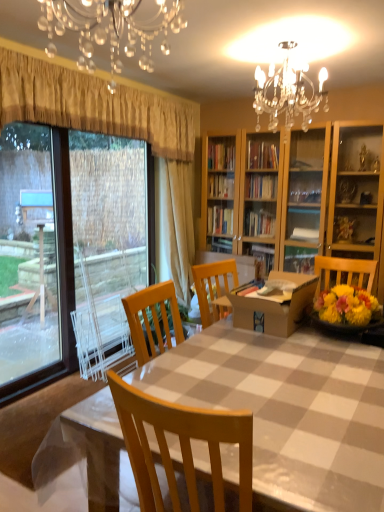
At what (x,y) coordinates should I click in order to perform the action: click on cardboard box at center. Please return your answer as a coordinate pair (x, y). Looking at the image, I should click on (274, 306).

The image size is (384, 512). Identify the location of crystal glass chandelier at upper center. (110, 29).

What do you see at coordinates (94, 105) in the screenshot? I see `gold textured curtain at upper left, positioned as the 1th curtain in front-to-back order` at bounding box center [94, 105].

The height and width of the screenshot is (512, 384). In order to click on gold textured curtain at upper left, positioned as the 1th curtain in front-to-back order in this screenshot , I will do `click(94, 105)`.

Measure the distance between point (x=337, y=507) and camera.

1.03 meters.

What do you see at coordinates (175, 225) in the screenshot?
I see `beige fabric curtain at center, which appears as the 2th curtain when viewed from the front` at bounding box center [175, 225].

Find the location of a particular element. cardboard box at center is located at coordinates (274, 306).

Would you say crystal glass chandelier at upper center is outside checkered plastic table at center?

crystal glass chandelier at upper center lies outside checkered plastic table at center's area.

From a real-world perspective, which is physically below, crystal glass chandelier at upper center or checkered plastic table at center?

checkered plastic table at center is physically lower.

Could you tell me if crystal glass chandelier at upper center is facing checkered plastic table at center?

No, crystal glass chandelier at upper center is not turned towards checkered plastic table at center.

Is crystal glass chandelier at upper center directly adjacent to checkered plastic table at center?

No, crystal glass chandelier at upper center is not beside checkered plastic table at center.

Which is more to the left, gold textured curtain at upper left, positioned as the 1th curtain in front-to-back order, or checkered plastic table at center?

Positioned to the left is gold textured curtain at upper left, positioned as the 1th curtain in front-to-back order.

Is gold textured curtain at upper left, positioned as the 1th curtain in front-to-back order, aimed at checkered plastic table at center?

No.

From a real-world perspective, does gold textured curtain at upper left, positioned as the 1th curtain in front-to-back order, sit lower than checkered plastic table at center?

No, from a real-world perspective, gold textured curtain at upper left, positioned as the 1th curtain in front-to-back order, is not under checkered plastic table at center.

Can you confirm if gold textured curtain at upper left, positioned as the 1th curtain in front-to-back order, is shorter than checkered plastic table at center?

Yes, gold textured curtain at upper left, positioned as the 1th curtain in front-to-back order, is shorter than checkered plastic table at center.

Is clear glass window at left not near crystal glass chandelier at upper center?

Yes, clear glass window at left is far from crystal glass chandelier at upper center.

Find the location of `bay window below the crystal glass chandelier at upper center (from a real-world perspective)`. bay window below the crystal glass chandelier at upper center (from a real-world perspective) is located at coordinates (59, 278).

Which of these two, clear glass window at left or crystal glass chandelier at upper center, is smaller?

crystal glass chandelier at upper center is smaller.

Does point (60, 210) appear closer or farther from the camera than point (51, 46)?

Point (60, 210) is farther from the camera than point (51, 46).

Based on the photo, which of these two, clear glass window at left or cardboard box at center, is smaller?

With smaller size is cardboard box at center.

Considering the points (63, 134) and (231, 298), which point is behind, point (63, 134) or point (231, 298)?

The point (63, 134) is farther from the camera.

Image resolution: width=384 pixels, height=512 pixels. In order to click on bay window above the cardboard box at center (from a real-world perspective) in this screenshot , I will do `click(59, 278)`.

Is clear glass window at left outside of cardboard box at center?

Indeed, clear glass window at left is completely outside cardboard box at center.

From the image's perspective, is beige fabric curtain at center, which appears as the 2th curtain when viewed from the front, on clear glass window at left?

Yes, from the image's perspective, beige fabric curtain at center, which appears as the 2th curtain when viewed from the front, is on top of clear glass window at left.

Is beige fabric curtain at center, which appears as the 2th curtain when viewed from the front, shorter than clear glass window at left?

Indeed, beige fabric curtain at center, which appears as the 2th curtain when viewed from the front, has a lesser height compared to clear glass window at left.

Choose the correct answer: Is beige fabric curtain at center, the 1th curtain when ordered from back to front, inside clear glass window at left or outside it?

beige fabric curtain at center, the 1th curtain when ordered from back to front, exists outside the volume of clear glass window at left.

Is beige fabric curtain at center, which appears as the 2th curtain when viewed from the front, oriented towards clear glass window at left?

No, beige fabric curtain at center, which appears as the 2th curtain when viewed from the front, is not aimed at clear glass window at left.

Is clear glass window at left next to checkered plastic table at center?

clear glass window at left and checkered plastic table at center are clearly separated.

Does point (68, 241) lie in front of point (374, 460)?

No, it is not.

Considering the sizes of clear glass window at left and checkered plastic table at center in the image, is clear glass window at left taller or shorter than checkered plastic table at center?

In the image, clear glass window at left appears to be taller than checkered plastic table at center.

Choose the correct answer: Is clear glass window at left inside checkered plastic table at center or outside it?

clear glass window at left is located beyond the bounds of checkered plastic table at center.

Are gold textured curtain at upper left, positioned as the 1th curtain in front-to-back order, and crystal glass chandelier at upper center far apart?

No, gold textured curtain at upper left, positioned as the 1th curtain in front-to-back order, is not far away from crystal glass chandelier at upper center.

Which is closer to the camera, [41,106] or [128,24]?

Point [128,24]

Is gold textured curtain at upper left, positioned as the 1th curtain in front-to-back order, bigger or smaller than crystal glass chandelier at upper center?

Clearly, gold textured curtain at upper left, positioned as the 1th curtain in front-to-back order, is larger in size than crystal glass chandelier at upper center.

Can you confirm if gold textured curtain at upper left, positioned as the 2th curtain in back-to-front order, is positioned to the left of crystal glass chandelier at upper center?

Correct, you'll find gold textured curtain at upper left, positioned as the 2th curtain in back-to-front order, to the left of crystal glass chandelier at upper center.

Find the location of a particular element. This screenshot has width=384, height=512. lamp lying in front of the checkered plastic table at center is located at coordinates coord(110,29).

The image size is (384, 512). I want to click on kitchen & dining room table on the right of the gold textured curtain at upper left, positioned as the 1th curtain in front-to-back order, so click(x=289, y=408).

Considering their positions, is checkered plastic table at center positioned closer to cardboard box at center than crystal glass chandelier at upper center?

checkered plastic table at center lies closer to cardboard box at center than the other object.

When comparing their distances from clear glass window at left, does gold textured curtain at upper left, positioned as the 2th curtain in back-to-front order, or crystal glass chandelier at upper center seem closer?

gold textured curtain at upper left, positioned as the 2th curtain in back-to-front order, is closer to clear glass window at left.

Based on the photo, based on their spatial positions, is clear glass window at left or crystal glass chandelier at upper center further from gold textured curtain at upper left, positioned as the 2th curtain in back-to-front order?

clear glass window at left is further to gold textured curtain at upper left, positioned as the 2th curtain in back-to-front order.

Based on their spatial positions, is gold textured curtain at upper left, positioned as the 1th curtain in front-to-back order, or beige fabric curtain at center, the 1th curtain when ordered from back to front, further from crystal glass chandelier at upper center?

The object further to crystal glass chandelier at upper center is beige fabric curtain at center, the 1th curtain when ordered from back to front.

In the scene shown: From the image, which object appears to be nearer to checkered plastic table at center, gold textured curtain at upper left, positioned as the 1th curtain in front-to-back order, or cardboard box at center?

cardboard box at center lies closer to checkered plastic table at center than the other object.

Which object lies further to the anchor point checkered plastic table at center, cardboard box at center or clear glass window at left?

clear glass window at left is positioned further to the anchor checkered plastic table at center.

When comparing their distances from cardboard box at center, does checkered plastic table at center or beige fabric curtain at center, which appears as the 2th curtain when viewed from the front, seem further?

beige fabric curtain at center, which appears as the 2th curtain when viewed from the front, lies further to cardboard box at center than the other object.

Which object lies further to the anchor point checkered plastic table at center, beige fabric curtain at center, the 1th curtain when ordered from back to front, or cardboard box at center?

beige fabric curtain at center, the 1th curtain when ordered from back to front, is further to checkered plastic table at center.

Identify the location of round table between checkered plastic table at center and beige fabric curtain at center, the 1th curtain when ordered from back to front, in the front-back direction. The height and width of the screenshot is (512, 384). (274, 306).

At what (x,y) coordinates should I click in order to perform the action: click on curtain located between crystal glass chandelier at upper center and beige fabric curtain at center, the 1th curtain when ordered from back to front, in the depth direction. Please return your answer as a coordinate pair (x, y). The image size is (384, 512). Looking at the image, I should click on (94, 105).

Find the location of a particular element. This screenshot has height=512, width=384. lamp between gold textured curtain at upper left, positioned as the 2th curtain in back-to-front order, and checkered plastic table at center, in the vertical direction is located at coordinates (110, 29).

This screenshot has height=512, width=384. I want to click on bay window between checkered plastic table at center and beige fabric curtain at center, the 1th curtain when ordered from back to front, in the front-back direction, so click(59, 278).